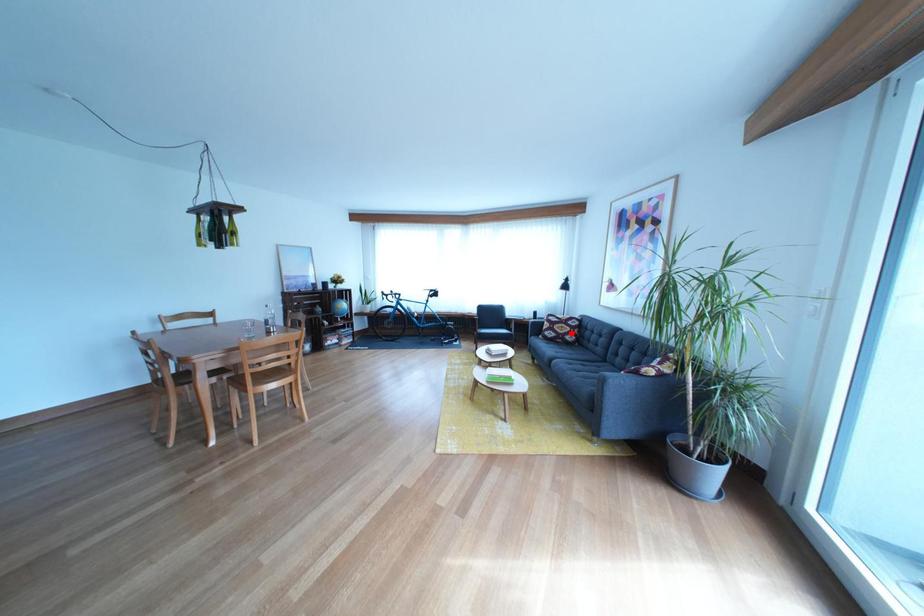
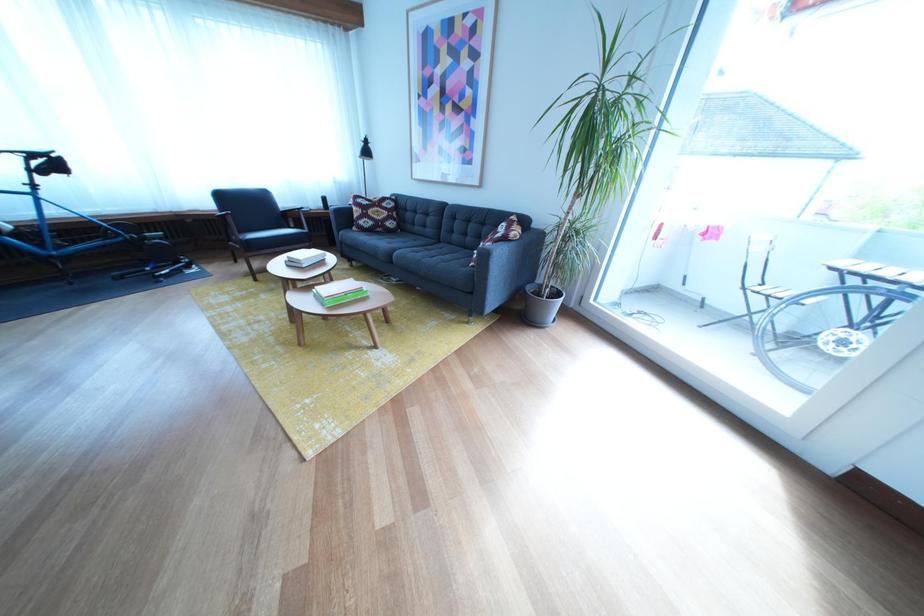
Where in the second image is the point corresponding to the highlighted location from the first image?

(386, 219)